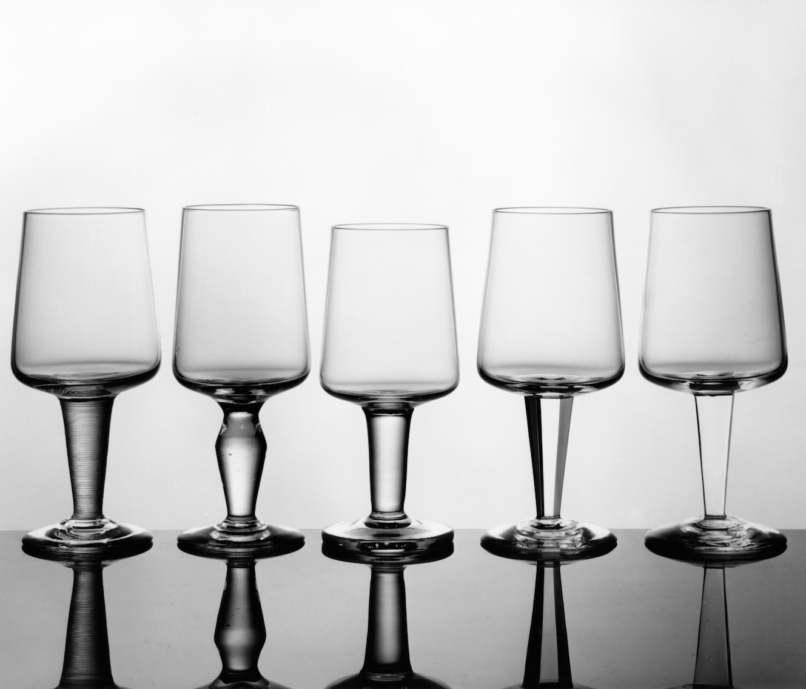
You are a GUI agent. You are given a task and a screenshot of the screen. Output one action in this format:
    pyautogui.click(x=<x>, y=<y>)
    Task: Click on the wine glass
    
    Given the screenshot: What is the action you would take?
    pyautogui.click(x=86, y=348), pyautogui.click(x=226, y=335), pyautogui.click(x=392, y=342), pyautogui.click(x=563, y=324), pyautogui.click(x=715, y=329)